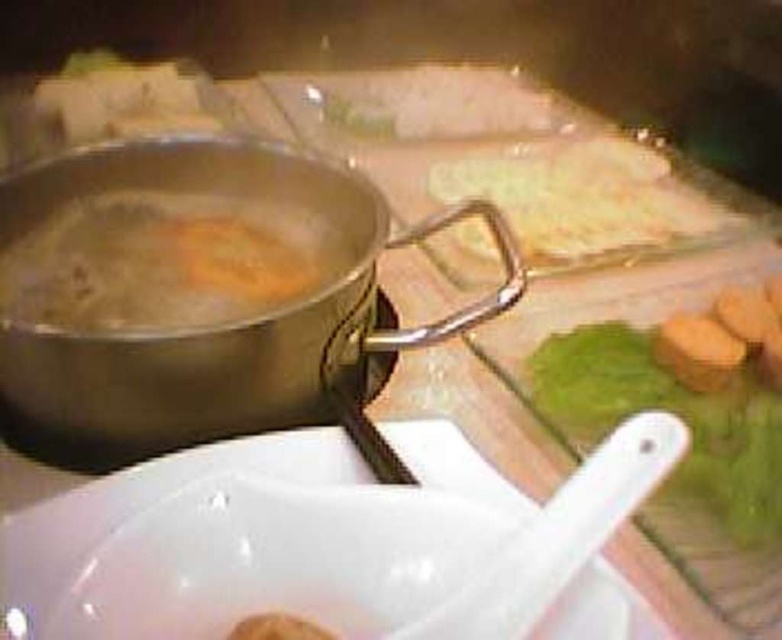
You are preparing a dish and need to know the order of the ingredients from top to bottom. Which ingredient is above the other between the orange soft bread at center and the translucent glass noodles at upper center?

The translucent glass noodles at upper center are above the orange soft bread at center since they are positioned over it.

You are a chef preparing a dish and need to place the orange soft bread at center and the translucent glass noodles at upper center onto a serving platter. The platter has a diameter of 10 inches. Can both items fit on the platter without overlapping?

A: The orange soft bread at center and translucent glass noodles at upper center are 10.15 inches apart. Since the platter is only 10 inches in diameter, the distance between them exceeds the platter size, so they cannot fit without overlapping.